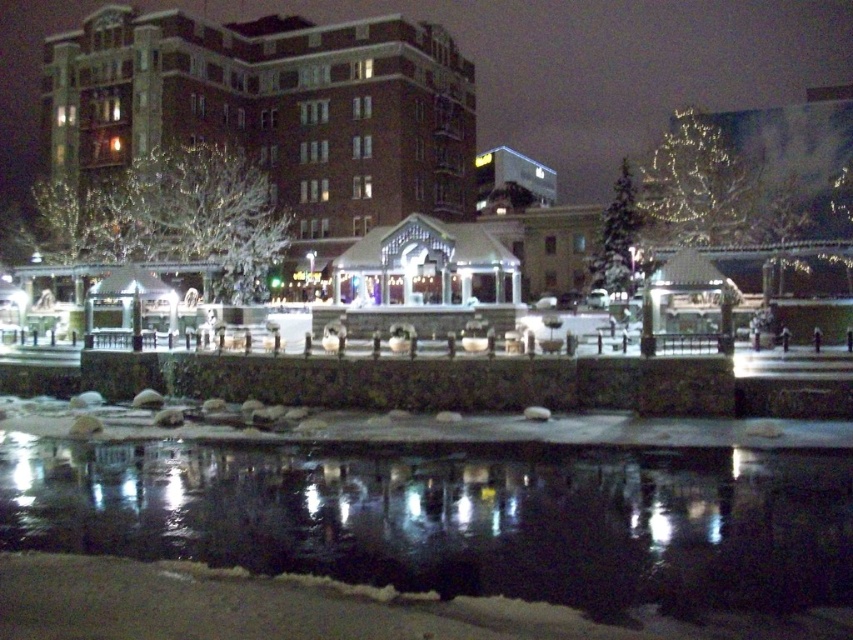
Question: Where is black reflective water at lower center located in relation to brick building at upper center in the image?

Choices:
 (A) above
 (B) below

Answer: (B)

Question: Which point appears closest to the camera in this image?

Choices:
 (A) (585, 614)
 (B) (296, 138)

Answer: (A)

Question: Is black reflective water at lower center thinner than brick building at upper center?

Choices:
 (A) no
 (B) yes

Answer: (B)

Question: Which point is closer to the camera?

Choices:
 (A) (225, 458)
 (B) (376, 218)

Answer: (A)

Question: Can you confirm if black reflective water at lower center is bigger than brick building at upper center?

Choices:
 (A) yes
 (B) no

Answer: (B)